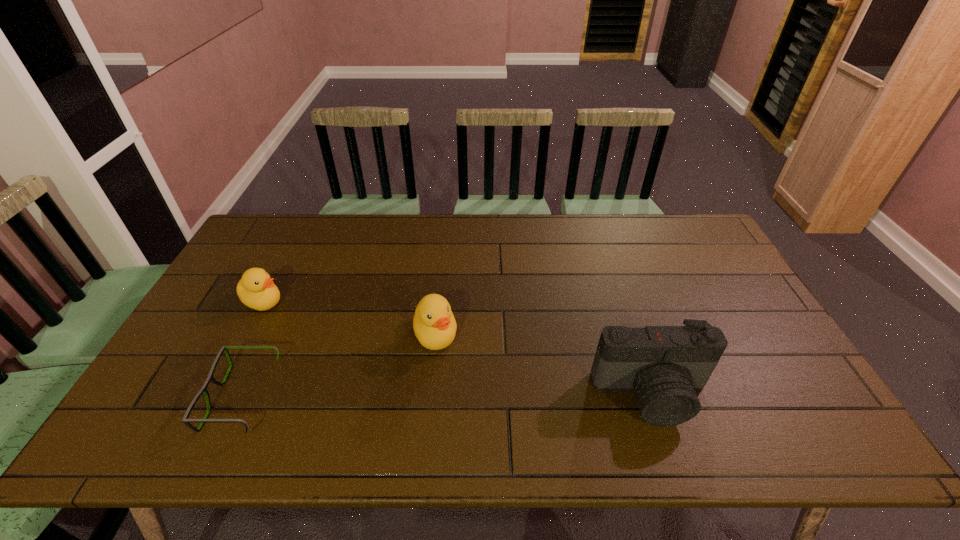
Find the location of a particular element. Image resolution: width=960 pixels, height=540 pixels. vacant spot on the desktop that is between the shortest object and the rightmost object and is positioned at the beak of the second object from right to left is located at coordinates (450, 396).

Find the location of `vacant space on the desktop that is between the spectacles and the tallest object and is positioned on the face of the duckling`. vacant space on the desktop that is between the spectacles and the tallest object and is positioned on the face of the duckling is located at coordinates (437, 396).